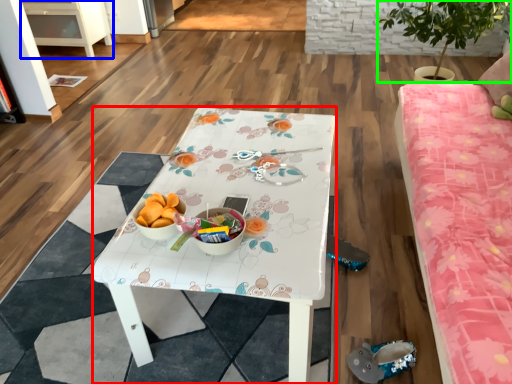
Question: Which is nearer to the desk (highlighted by a red box)? cabinetry (highlighted by a blue box) or houseplant (highlighted by a green box).

Choices:
 (A) cabinetry
 (B) houseplant

Answer: (B)